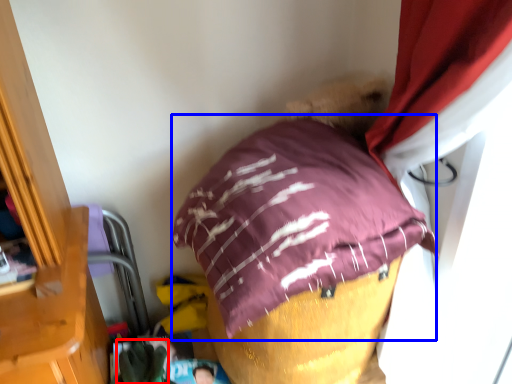
Question: Which object is further to the camera taking this photo, clothing (highlighted by a red box) or pillow (highlighted by a blue box)?

Choices:
 (A) clothing
 (B) pillow

Answer: (A)